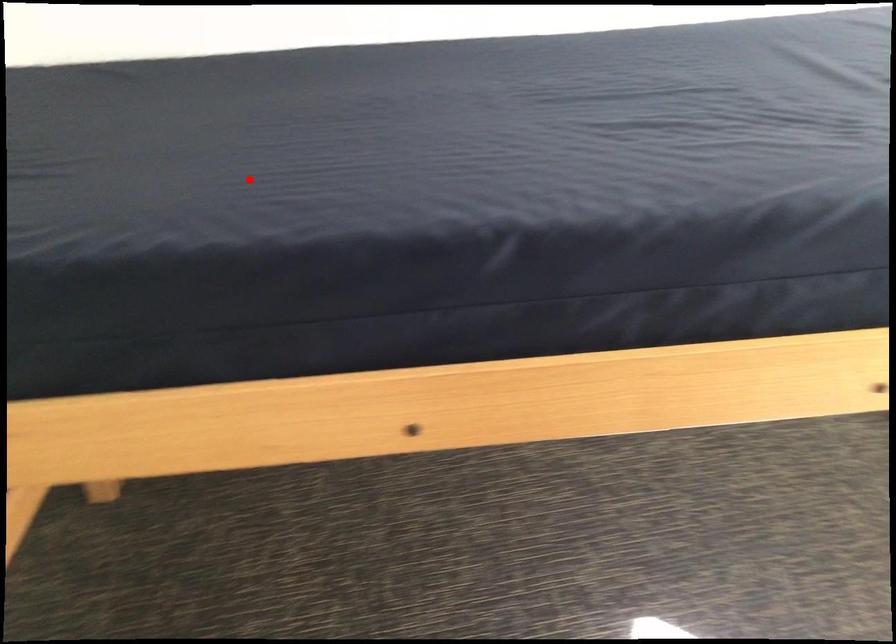
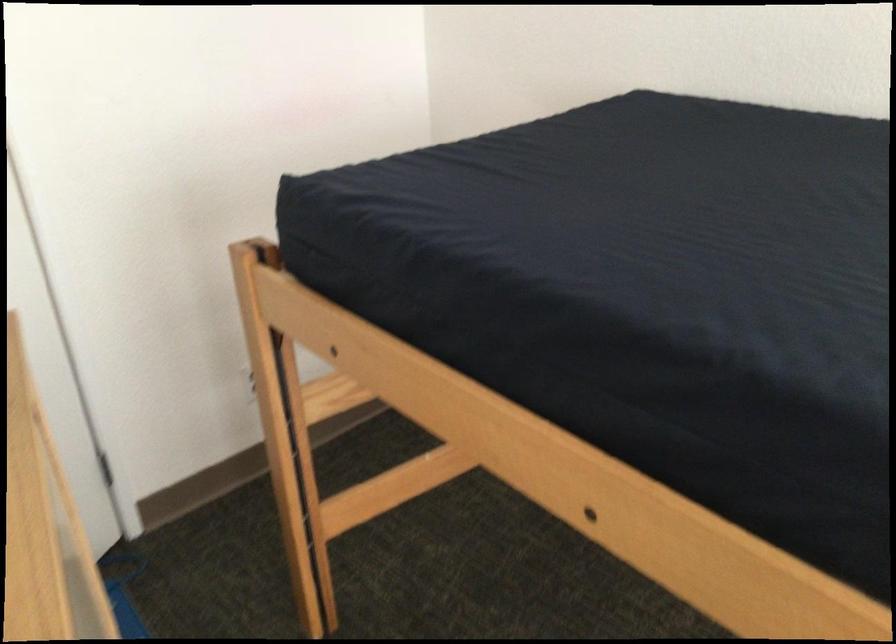
Where in the second image is the point corresponding to the highlighted location from the first image?

(636, 228)